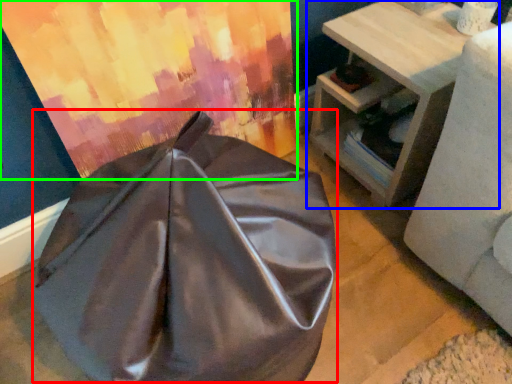
Question: Based on their relative distances, which object is farther from bean bag chair (highlighted by a red box)? Choose from table (highlighted by a blue box) and curtain (highlighted by a green box).

Choices:
 (A) table
 (B) curtain

Answer: (A)